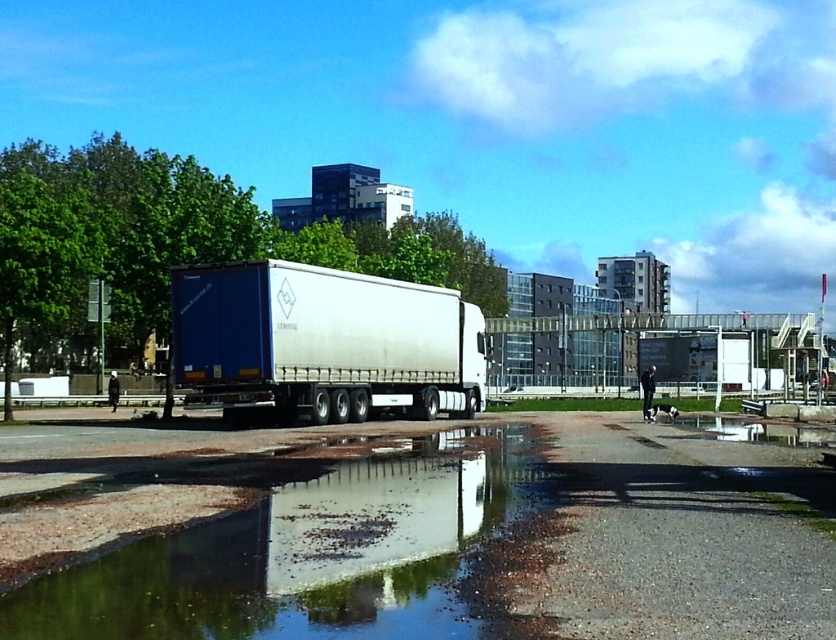
Find the location of a particular element. This screenshot has height=640, width=836. clear water at lower center is located at coordinates (314, 556).

Is clear water at lower center thinner than matte white trailer truck at center?

Indeed, clear water at lower center has a lesser width compared to matte white trailer truck at center.

Between point (441, 516) and point (418, 419), which one is positioned behind?

Point (418, 419)

I want to click on clear water at lower center, so click(x=314, y=556).